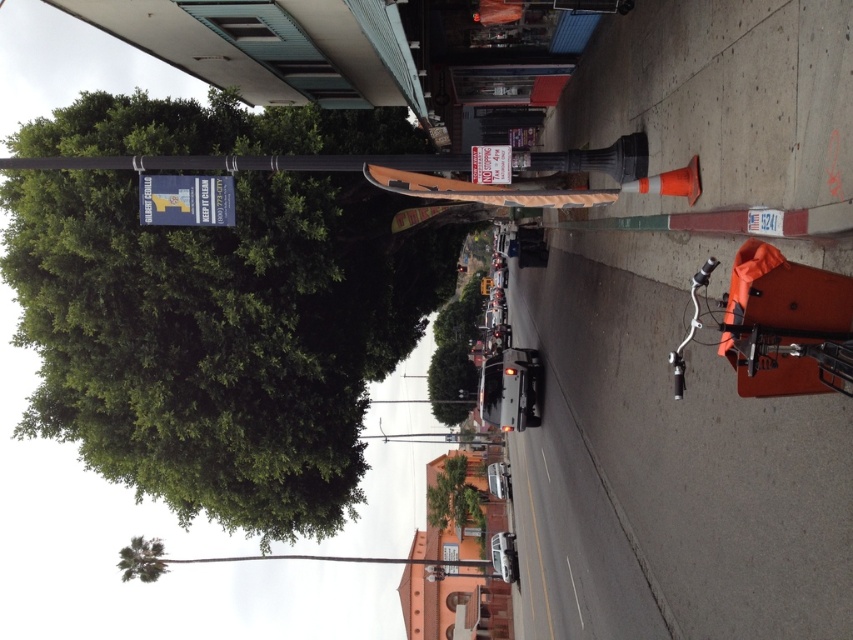
You are a pedestrian standing on the sidewalk and want to take a photo of both the green leafy tree at upper left and the green leafy tree at lower left. Which tree should you move closer to in order to include both in the frame without cropping either?

To include both the green leafy tree at upper left and the green leafy tree at lower left in the frame without cropping, you should move closer to the green leafy tree at upper left since it occupies less space and would require a wider angle or closer proximity to capture both effectively.

You are a pedestrian standing on the sidewalk and want to walk towards the green leafy tree at lower left. However, there is a green leafy tree at center blocking your path. Can you walk around it to reach your destination?

The green leafy tree at center is closer to you than the green leafy tree at lower left. Since it is in front of you, you can walk around it to reach the green leafy tree at lower left.

You are a delivery driver who needs to make a U turn in this street. The minimum turning radius for your truck is 60 feet. Based on the distance between the green leafy tree at center and the green leafy tree at lower left, can you safely make the U turn here?

The distance between the green leafy tree at center and the green leafy tree at lower left is 65.39 feet. Since the minimum turning radius for the truck is 60 feet, the U turn can be safely made here as the available space exceeds the required turning radius.